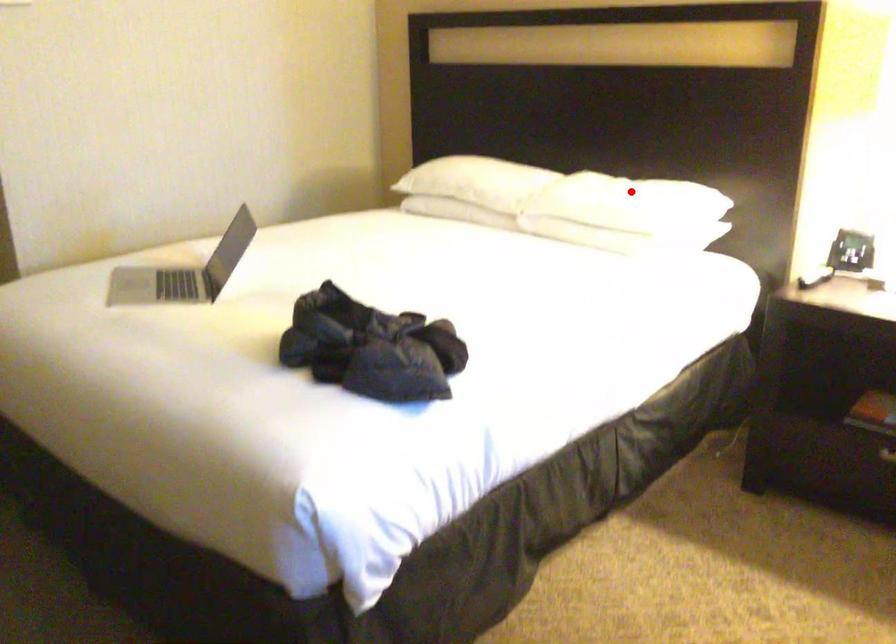
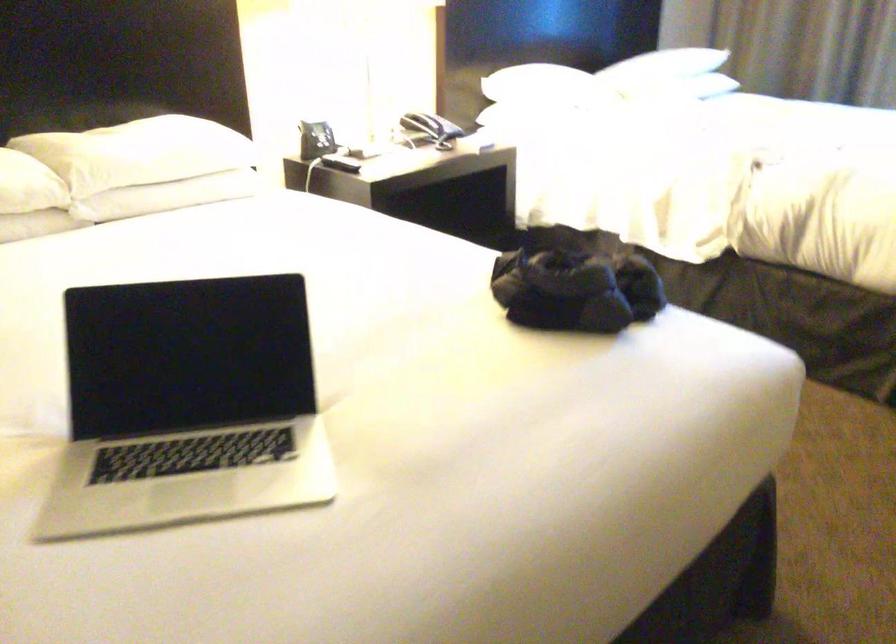
Question: I am providing you with two images of the same scene from different viewpoints. Image1 has a red point marked. In image2, the corresponding 3D location appears at what relative position? Reply with the corresponding letter.

Choices:
 (A) Closer
 (B) Farther

Answer: (A)